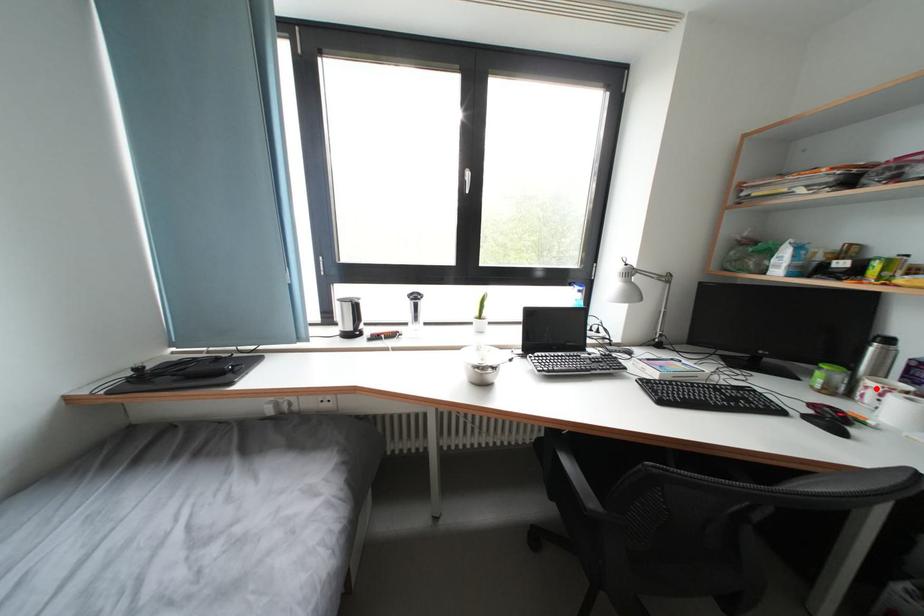
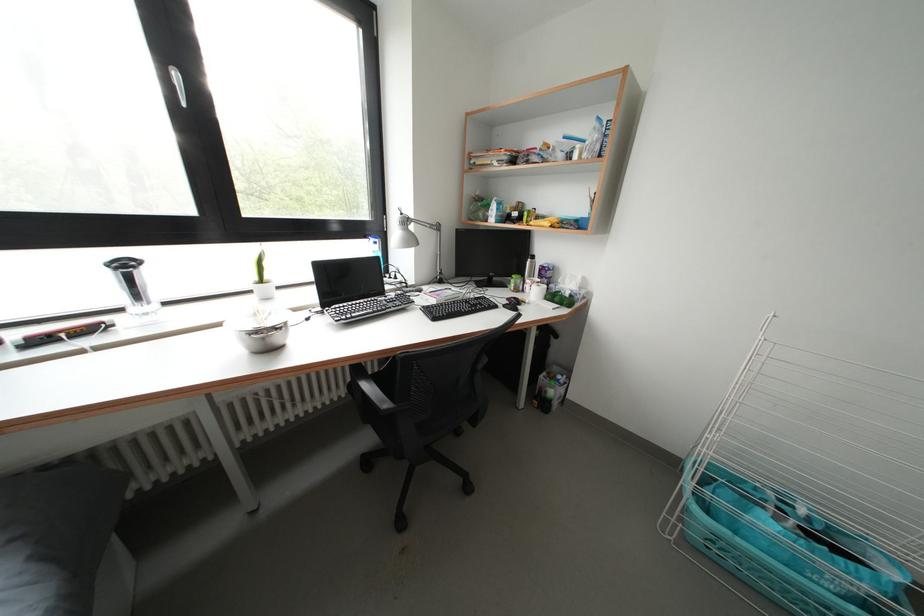
Question: I am providing you with two images of the same scene from different viewpoints. Given a red point in image1, look at the same physical point in image2. Is it:

Choices:
 (A) Closer to the viewpoint
 (B) Farther from the viewpoint

Answer: (A)